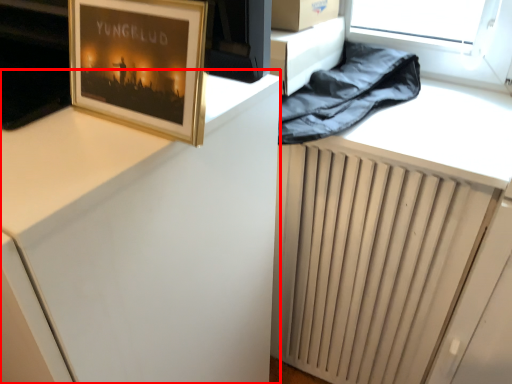
Question: From the image's perspective, considering the relative positions of computer desk (annotated by the red box) and picture frame in the image provided, where is computer desk (annotated by the red box) located with respect to the staircase?

Choices:
 (A) above
 (B) below

Answer: (B)